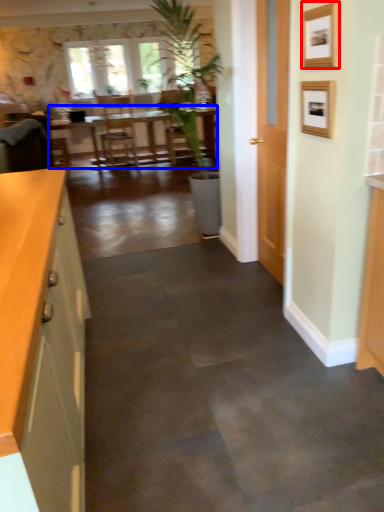
Question: Which object appears farthest to the camera in this image, picture frame (highlighted by a red box) or table (highlighted by a blue box)?

Choices:
 (A) picture frame
 (B) table

Answer: (B)